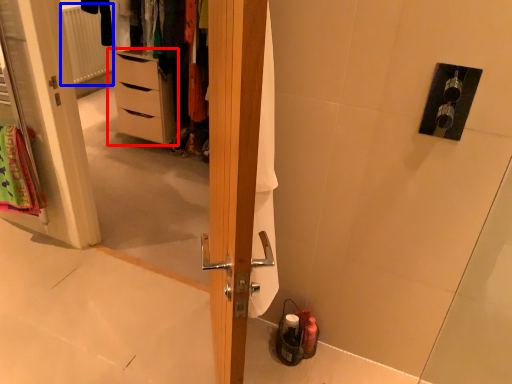
Question: Which object appears farthest to the camera in this image, chest of drawers (highlighted by a red box) or radiator (highlighted by a blue box)?

Choices:
 (A) chest of drawers
 (B) radiator

Answer: (B)